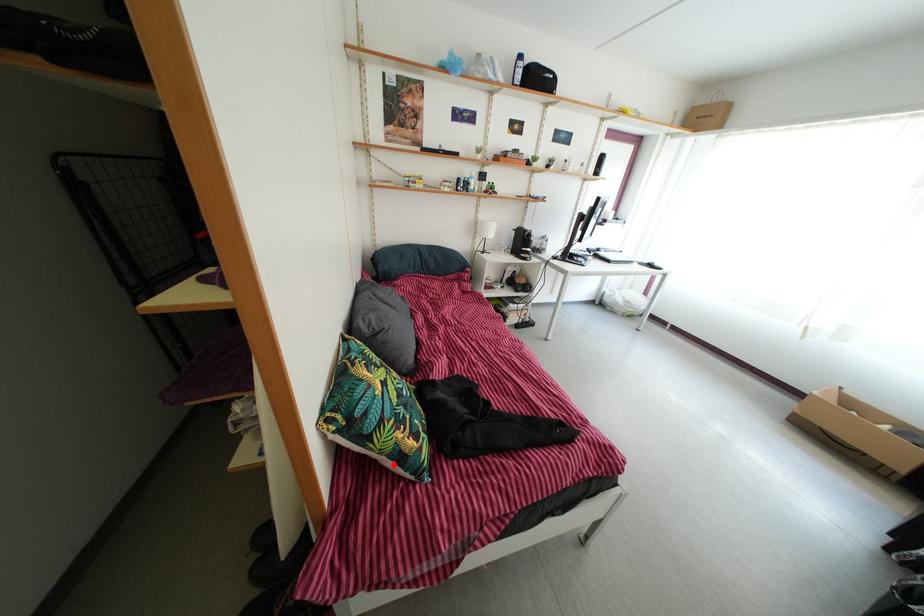
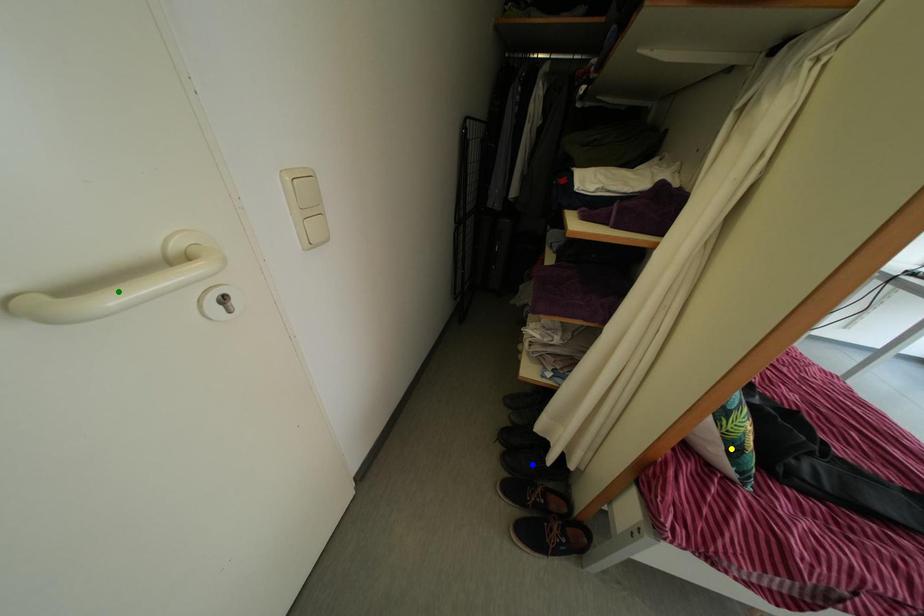
Question: I am providing you with two images of the same scene from different viewpoints. A red point is marked on the first image. You are given multiple points on the second image. Which spot in image 2 lines up with the point in image 1?

Choices:
 (A) yellow point
 (B) green point
 (C) blue point

Answer: (A)